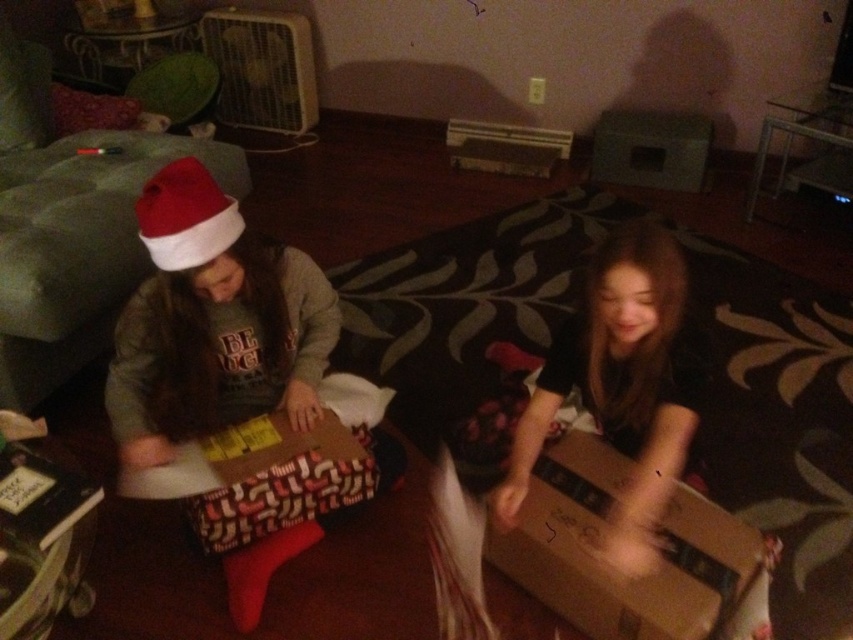
You are standing in the living room and see the point marked at coordinates (213,324). What is located at that point?

The point at coordinates (213,324) corresponds to the matte gray sweater at center.

You are a delivery robot with a 24 inch wide arm. You need to place a gift into the brown cardboard box at lower right. The gift is currently on the matte gray sweater at center. Can your arm reach the box without moving the sweater?

The distance between the matte gray sweater at center and the brown cardboard box at lower right is 23.85 inches. Since the robot arm is 24 inches wide, it can reach the box without needing to move the sweater.

You are a parent trying to organize the gifts under the Christmas tree. You need to place the smooth cardboard box at center and the brown cardboard box at lower right in a row from left to right. Based on their current positions, which box should you place first on the left side of the row?

The smooth cardboard box at center should be placed first on the left side of the row because it is currently to the left of the brown cardboard box at lower right.